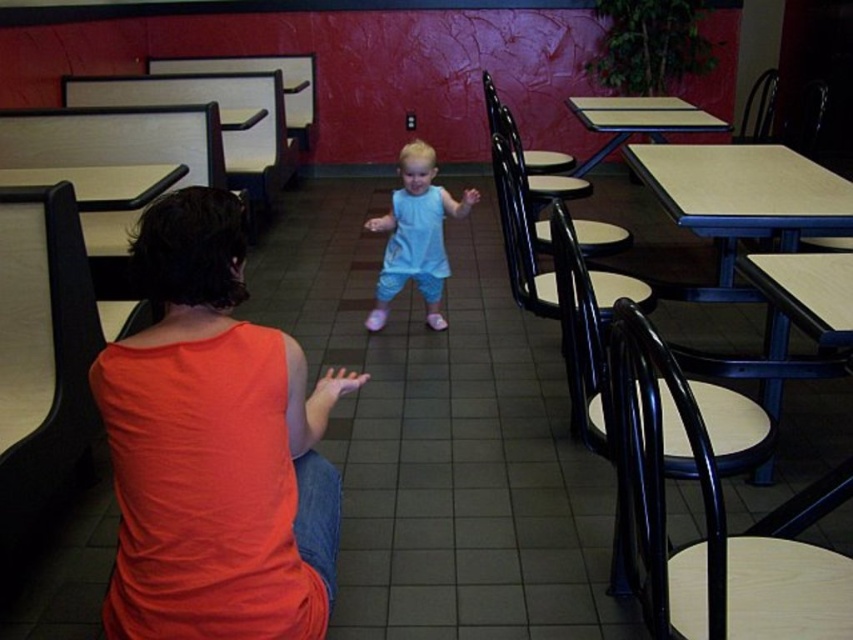
Question: Does light blue fabric dress at center appear under black plastic chair at upper right?

Choices:
 (A) no
 (B) yes

Answer: (B)

Question: Which point is farther to the camera?

Choices:
 (A) (764, 596)
 (B) (375, 321)
 (C) (688, 177)

Answer: (B)

Question: Can you confirm if black wood chair at right is bigger than light blue fabric dress at center?

Choices:
 (A) yes
 (B) no

Answer: (A)

Question: Among these points, which one is farthest from the camera?

Choices:
 (A) (612, 99)
 (B) (624, 292)
 (C) (50, 180)

Answer: (A)

Question: Which object is closer to the camera taking this photo?

Choices:
 (A) black plastic chair at upper right
 (B) metallic blue chair at lower right
 (C) light brown wood table at left

Answer: (B)

Question: Does black plastic chair at center come in front of wooden table at center?

Choices:
 (A) no
 (B) yes

Answer: (B)